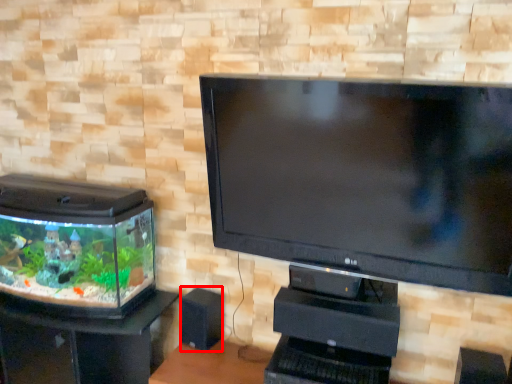
Question: From the image's perspective, where is speaker (annotated by the red box) located relative to furniture?

Choices:
 (A) above
 (B) below

Answer: (A)